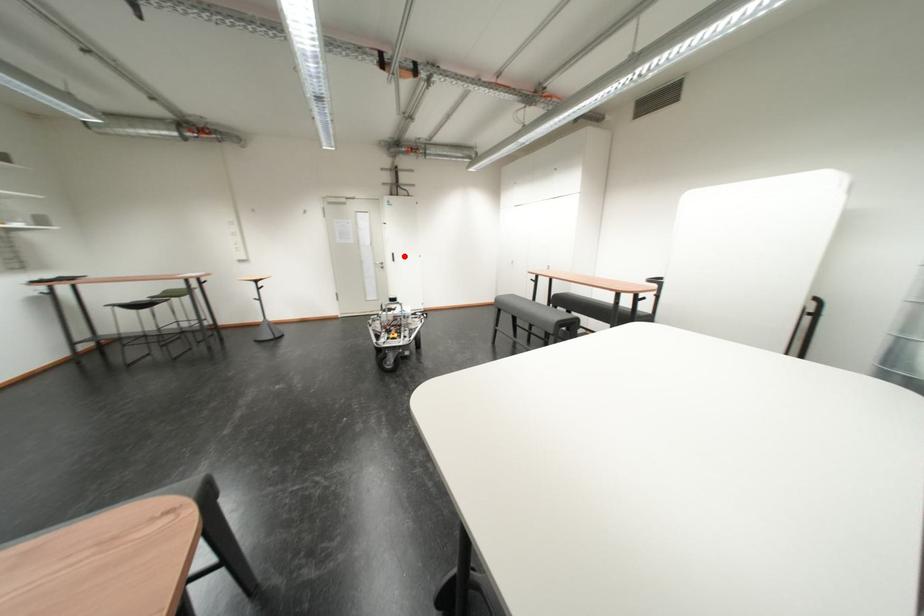
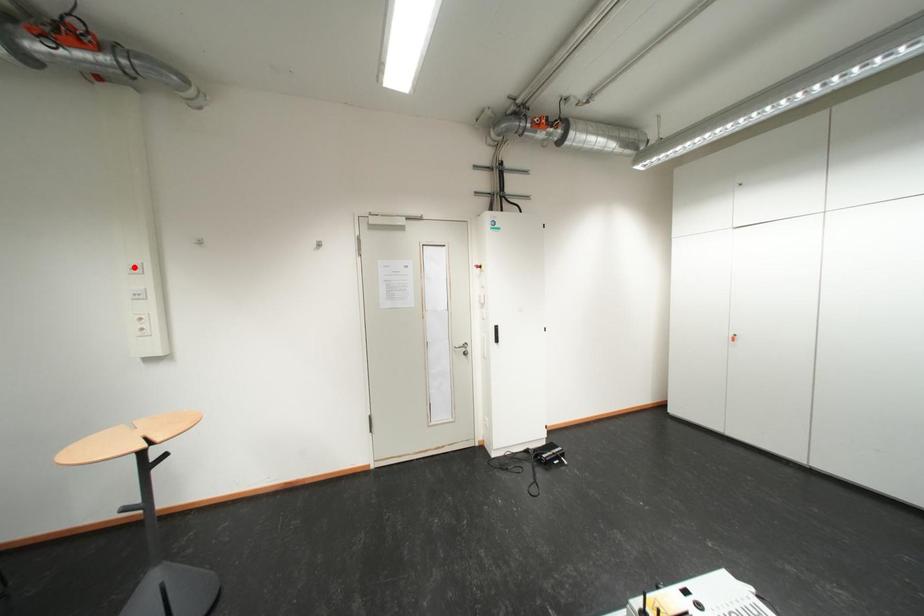
I am providing you with two images of the same scene from different viewpoints. A red point is marked on the first image and another point is marked on the second image. Is the red point in image1 aligned with the point shown in image2?

No